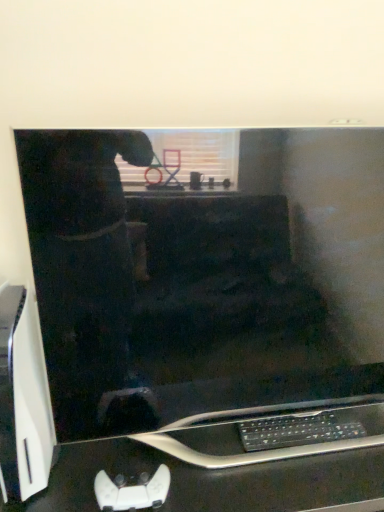
The width and height of the screenshot is (384, 512). Find the location of `vacant space positioned to the left of black plastic keyboard at lower center`. vacant space positioned to the left of black plastic keyboard at lower center is located at coordinates (224, 457).